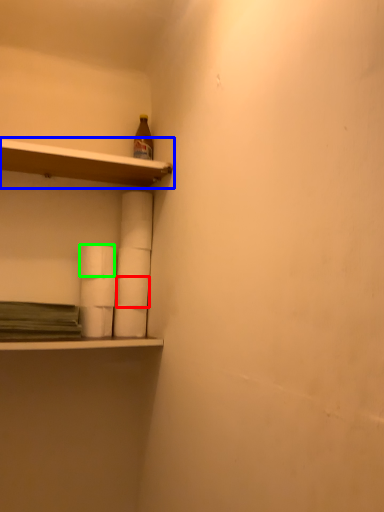
Question: Which object is the farthest from paper towel (highlighted by a red box)? Choose among these: shelf (highlighted by a blue box) or paper towel (highlighted by a green box).

Choices:
 (A) shelf
 (B) paper towel

Answer: (A)